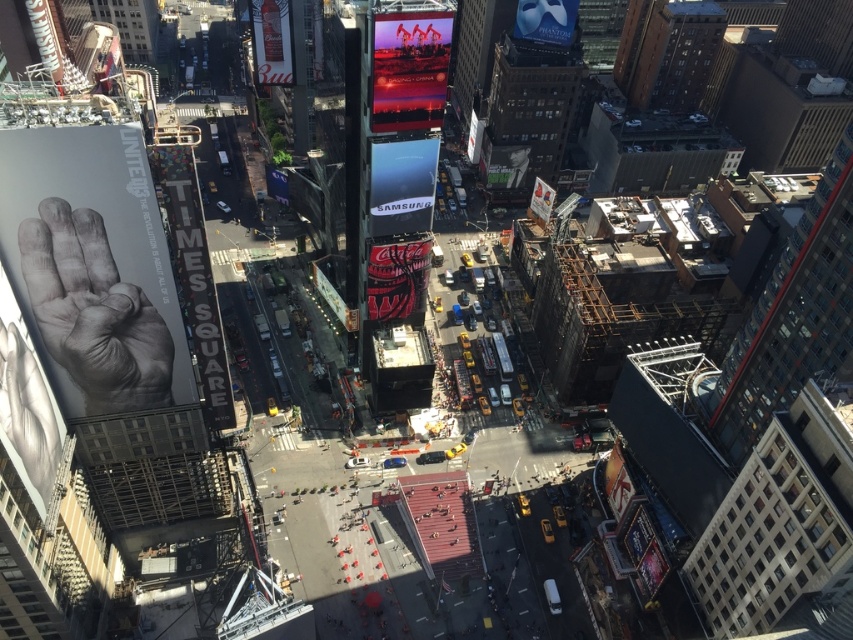
Question: Considering the real-world distances, which object is farthest from the shiny red coca-cola sign at center?

Choices:
 (A) shiny metallic billboard at upper center
 (B) metallic silver budweiser sign at upper left

Answer: (B)

Question: Is metallic silver budweiser sign at upper left to the right of matte white mask at upper center from the viewer's perspective?

Choices:
 (A) no
 (B) yes

Answer: (A)

Question: In this image, where is shiny metallic billboard at upper center located relative to matte white mask at upper center?

Choices:
 (A) above
 (B) below

Answer: (B)

Question: Among these points, which one is farthest from the camera?

Choices:
 (A) (270, 22)
 (B) (399, 275)

Answer: (A)

Question: Which object is the closest to the matte white mask at upper center?

Choices:
 (A) black matte hand at upper left
 (B) matte black samsung sign at center
 (C) metallic silver budweiser sign at upper left

Answer: (C)

Question: Can you confirm if white paper times square sign at left is positioned below shiny red coca-cola sign at center?

Choices:
 (A) no
 (B) yes

Answer: (B)